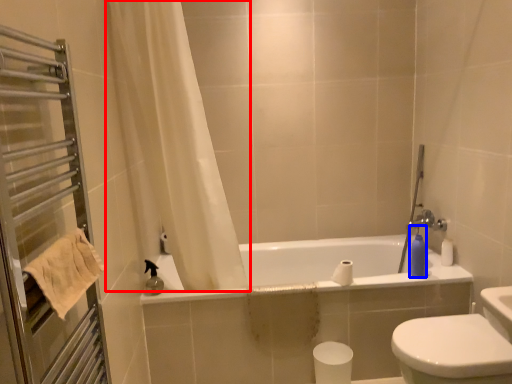
Question: Which object is further to the camera taking this photo, curtain (highlighted by a red box) or soap dispenser (highlighted by a blue box)?

Choices:
 (A) curtain
 (B) soap dispenser

Answer: (B)